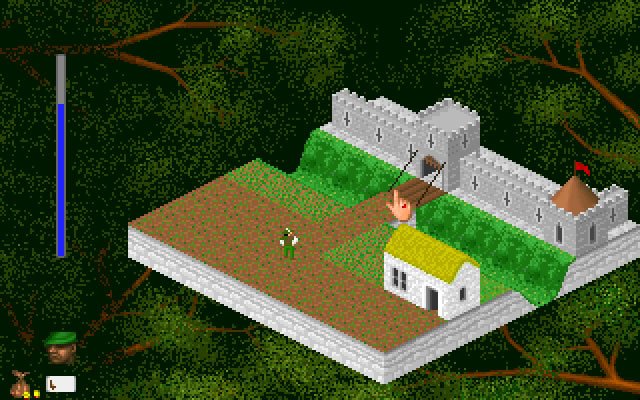
The width and height of the screenshot is (640, 400). Identify the location of house door. (432, 299).